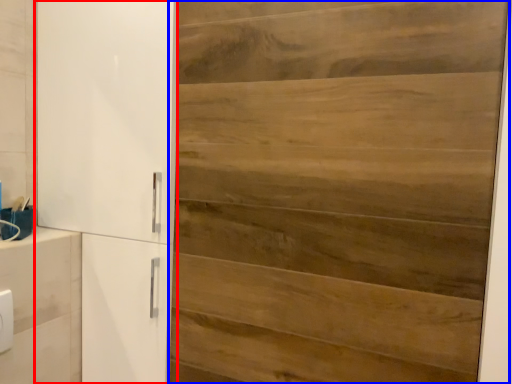
Question: Among these objects, which one is farthest to the camera, cupboard (highlighted by a red box) or door (highlighted by a blue box)?

Choices:
 (A) cupboard
 (B) door

Answer: (A)